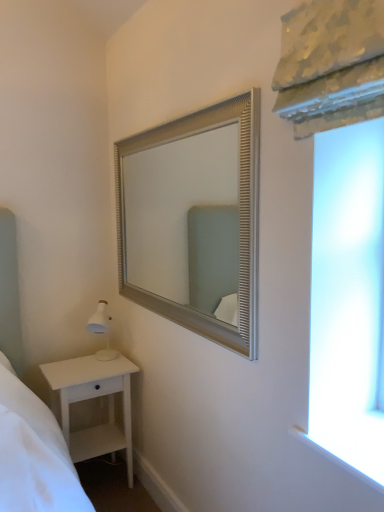
In order to face silver textured mirror at upper center, should I rotate leftwards or rightwards?

It's best to rotate left around 3.948 degrees.

Where is `silver textured mirror at upper center`? silver textured mirror at upper center is located at coordinates (174, 204).

This screenshot has width=384, height=512. Describe the element at coordinates (174, 204) in the screenshot. I see `silver textured mirror at upper center` at that location.

Where is `white matte nightstand at lower left`? white matte nightstand at lower left is located at coordinates (92, 398).

The image size is (384, 512). What do you see at coordinates (92, 398) in the screenshot?
I see `white matte nightstand at lower left` at bounding box center [92, 398].

Image resolution: width=384 pixels, height=512 pixels. Find the location of `silver textured mirror at upper center`. silver textured mirror at upper center is located at coordinates (174, 204).

Is silver textured mirror at upper center to the left or to the right of white matte nightstand at lower left in the image?

Based on their positions, silver textured mirror at upper center is located to the right of white matte nightstand at lower left.

Is silver textured mirror at upper center in front of or behind white matte nightstand at lower left in the image?

Clearly, silver textured mirror at upper center is in front of white matte nightstand at lower left.

Which point is more forward, (231, 193) or (81, 393)?

The point (81, 393) is closer to the camera.

From the image's perspective, is silver textured mirror at upper center under white matte nightstand at lower left?

No.

From a real-world perspective, is silver textured mirror at upper center positioned above or below white matte nightstand at lower left?

silver textured mirror at upper center is situated higher than white matte nightstand at lower left in the real world.

Between silver textured mirror at upper center and white matte nightstand at lower left, which one has smaller width?

silver textured mirror at upper center is thinner.

Is silver textured mirror at upper center taller than white matte nightstand at lower left?

Indeed, silver textured mirror at upper center has a greater height compared to white matte nightstand at lower left.

Is silver textured mirror at upper center bigger or smaller than white matte nightstand at lower left?

silver textured mirror at upper center is smaller than white matte nightstand at lower left.

Does silver textured mirror at upper center contain white matte nightstand at lower left?

No.

Looking at this image, is silver textured mirror at upper center next to white matte nightstand at lower left and touching it?

silver textured mirror at upper center and white matte nightstand at lower left are clearly separated.

Is silver textured mirror at upper center turned away from white matte nightstand at lower left?

No, silver textured mirror at upper center's orientation is not away from white matte nightstand at lower left.

Can you tell me how much silver textured mirror at upper center and white matte nightstand at lower left differ in facing direction?

They differ by 90 degrees in their facing directions.

Measure the distance between silver textured mirror at upper center and white matte nightstand at lower left.

silver textured mirror at upper center is 37.03 inches from white matte nightstand at lower left.

This screenshot has height=512, width=384. In the image, there is a white matte nightstand at lower left. In order to click on mirror above it (from the image's perspective) in this screenshot , I will do `click(174, 204)`.

Between white matte nightstand at lower left and silver textured mirror at upper center, which one appears on the right side from the viewer's perspective?

silver textured mirror at upper center.

Considering the positions of objects white matte nightstand at lower left and silver textured mirror at upper center in the image provided, who is in front, white matte nightstand at lower left or silver textured mirror at upper center?

silver textured mirror at upper center is in front.

Which point is more forward, (78, 444) or (140, 203)?

The point (78, 444) is in front.

From the image's perspective, which is below, white matte nightstand at lower left or silver textured mirror at upper center?

From the image's view, white matte nightstand at lower left is below.

From a real-world perspective, which is physically below, white matte nightstand at lower left or silver textured mirror at upper center?

From a 3D spatial view, white matte nightstand at lower left is below.

Is white matte nightstand at lower left wider or thinner than silver textured mirror at upper center?

Clearly, white matte nightstand at lower left has more width compared to silver textured mirror at upper center.

Considering the relative sizes of white matte nightstand at lower left and silver textured mirror at upper center in the image provided, is white matte nightstand at lower left shorter than silver textured mirror at upper center?

Yes, white matte nightstand at lower left is shorter than silver textured mirror at upper center.

Who is bigger, white matte nightstand at lower left or silver textured mirror at upper center?

white matte nightstand at lower left.

Is white matte nightstand at lower left outside of silver textured mirror at upper center?

Absolutely, white matte nightstand at lower left is external to silver textured mirror at upper center.

Is white matte nightstand at lower left beside silver textured mirror at upper center?

No.

Is silver textured mirror at upper center at the back of white matte nightstand at lower left?

white matte nightstand at lower left does not have its back to silver textured mirror at upper center.

How different are the orientations of white matte nightstand at lower left and silver textured mirror at upper center in degrees?

They differ by 90 degrees in their facing directions.

Locate an element on the screen. The height and width of the screenshot is (512, 384). nightstand below the silver textured mirror at upper center (from the image's perspective) is located at coordinates (92, 398).

Locate an element on the screen. This screenshot has width=384, height=512. nightstand that appears on the left of silver textured mirror at upper center is located at coordinates (92, 398).

Where is `mirror above the white matte nightstand at lower left (from the image's perspective)`? The height and width of the screenshot is (512, 384). mirror above the white matte nightstand at lower left (from the image's perspective) is located at coordinates (174, 204).